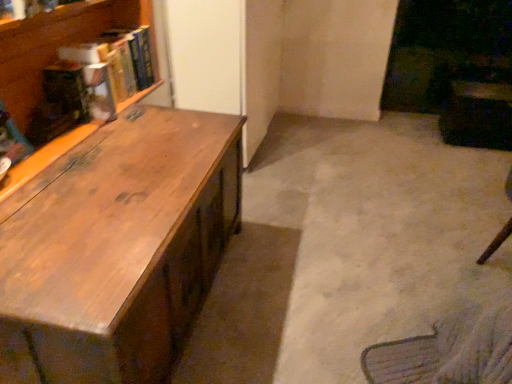
Question: In the image, is hardcover book at upper left, which is the 2th book in back-to-front order, positioned in front of or behind hardcover book at upper left, which is counted as the second book, starting from the front?

Choices:
 (A) behind
 (B) front

Answer: (B)

Question: Based on their positions, is hardcover book at upper left, which is the 2th book in back-to-front order, located to the left or right of hardcover book at upper left, which is the first book in back-to-front order?

Choices:
 (A) left
 (B) right

Answer: (A)

Question: Which object is the closest to the hardcover book at upper left, the 1th book in the front-to-back sequence?

Choices:
 (A) wooden desk at left
 (B) hardcover book at upper left, which is the first book in back-to-front order

Answer: (B)

Question: Which object is the closest to the hardcover book at upper left, which is the 2th book in back-to-front order?

Choices:
 (A) hardcover book at upper left, which is counted as the second book, starting from the front
 (B) wooden desk at left

Answer: (A)